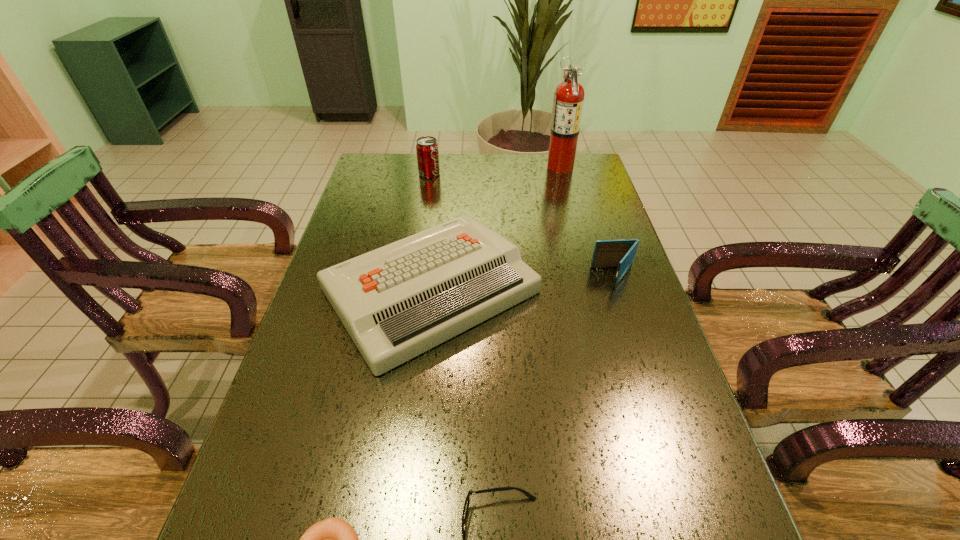
Identify the location of the tallest object. pos(568,100).

You are a GUI agent. You are given a task and a screenshot of the screen. Output one action in this format:
    pyautogui.click(x=<x>, y=<y>)
    Task: Click on the pop soda
    
    Given the screenshot: What is the action you would take?
    pyautogui.click(x=427, y=151)

Locate an element on the screen. The height and width of the screenshot is (540, 960). wallet is located at coordinates (607, 253).

Find the location of a particular element. The height and width of the screenshot is (540, 960). computer keyboard is located at coordinates (396, 302).

I want to click on free space located 0.070m on the nozzle side of the fire extinguisher, so point(528,166).

This screenshot has width=960, height=540. I want to click on vacant space located on the nozzle side of the fire extinguisher, so point(453,166).

Locate an element on the screen. free spot located 0.050m on the nozzle side of the fire extinguisher is located at coordinates (533, 166).

The height and width of the screenshot is (540, 960). Identify the location of free point located 0.180m on the right of the fifth shortest object. (490, 174).

This screenshot has width=960, height=540. Identify the location of vacant region located on the exterior surface of the wallet. (553, 278).

I want to click on free space located on the exterior surface of the wallet, so click(x=546, y=278).